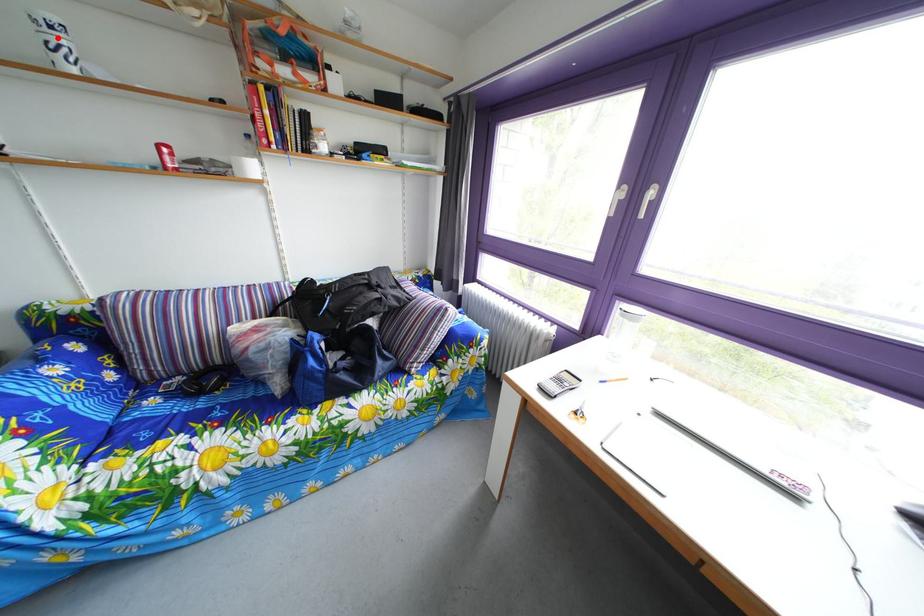
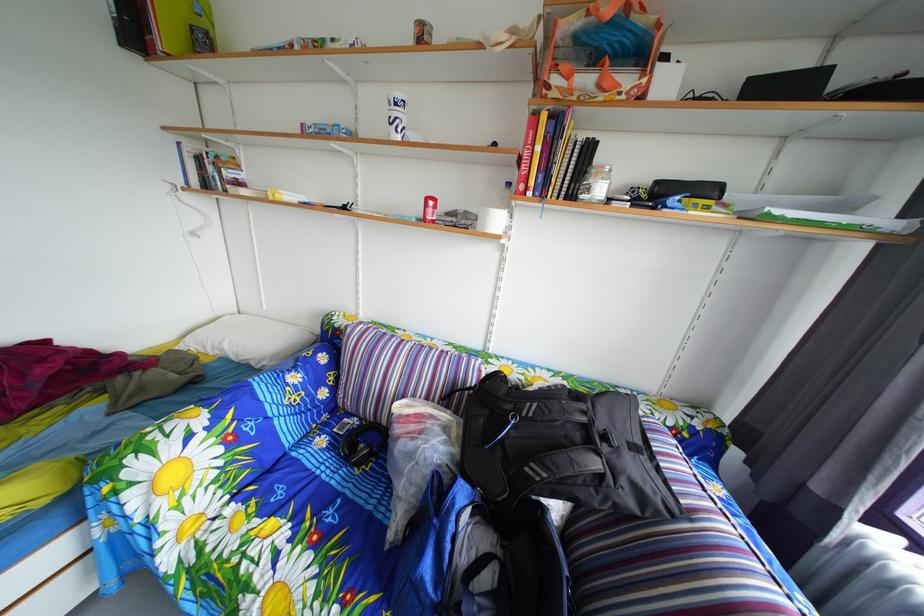
Locate, in the second image, the point that corresponds to the highlighted location in the first image.

(404, 116)